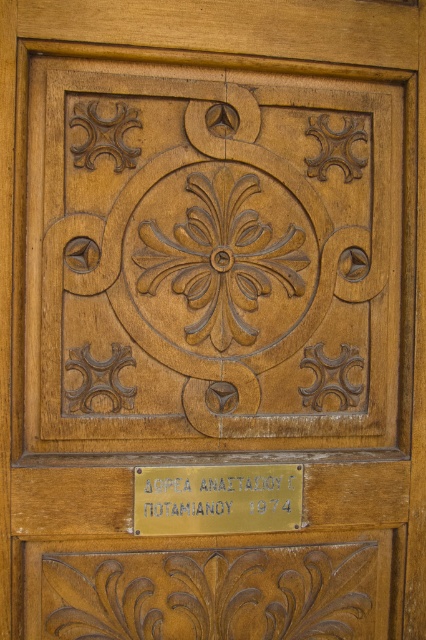
You are an architect examining a door with intricate carvings. You notice two carved elements on the door. One is the wooden carved design at center and the other is the brown carved flower at center. Which of these two elements is bigger?

The wooden carved design at center is larger in size than the brown carved flower at center.